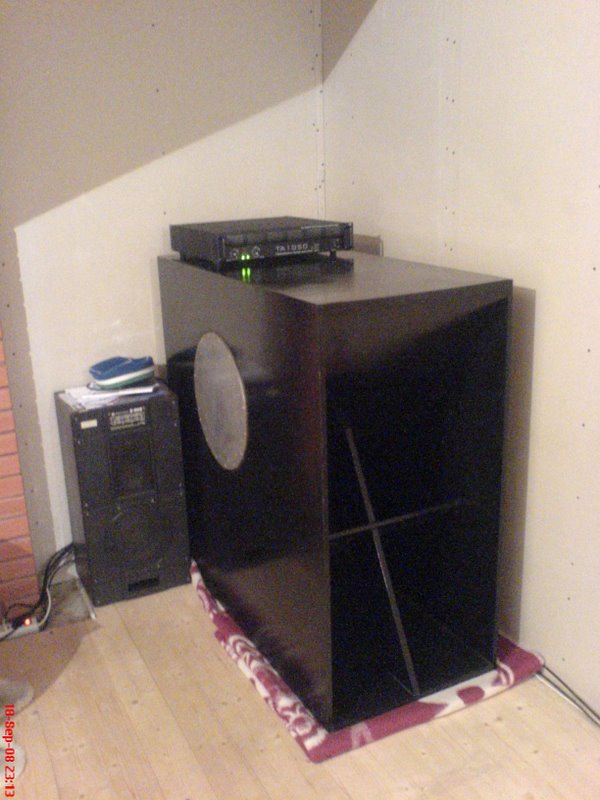
Where is `brick wall`? Image resolution: width=600 pixels, height=800 pixels. brick wall is located at coordinates (16, 517).